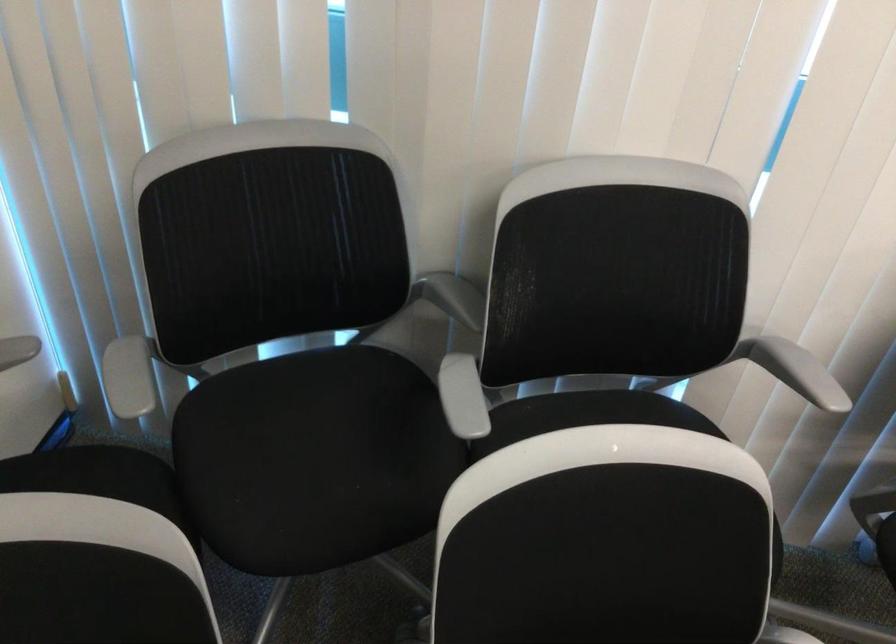
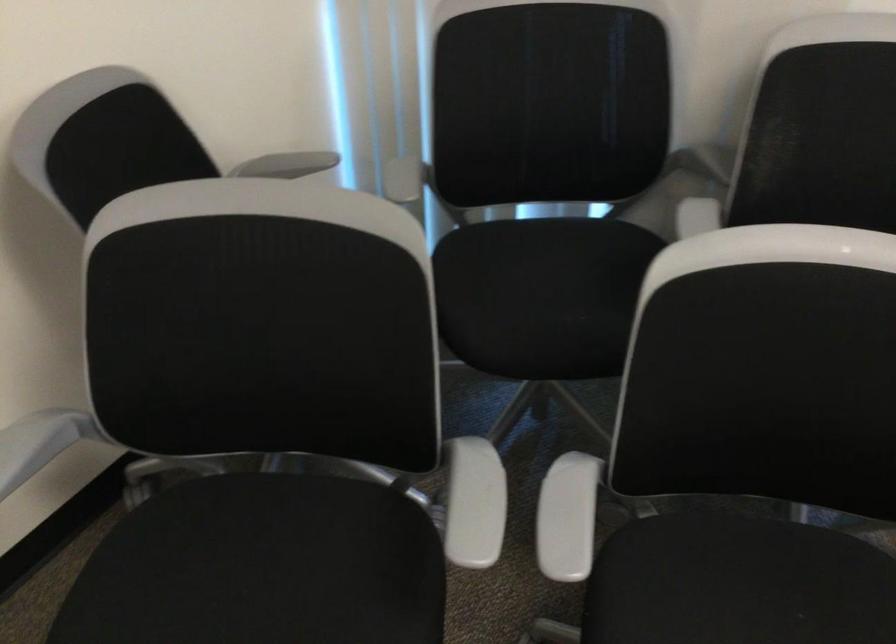
From the picture: Which direction would the cameraman need to move to produce the second image?

The cameraman moved toward right, backward.